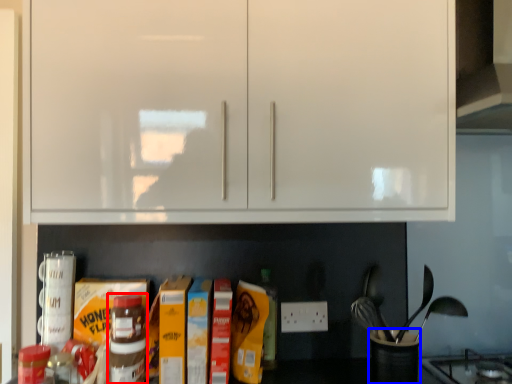
Question: Among these objects, which one is farthest to the camera, bottle (highlighted by a red box) or appliance (highlighted by a blue box)?

Choices:
 (A) bottle
 (B) appliance

Answer: (B)